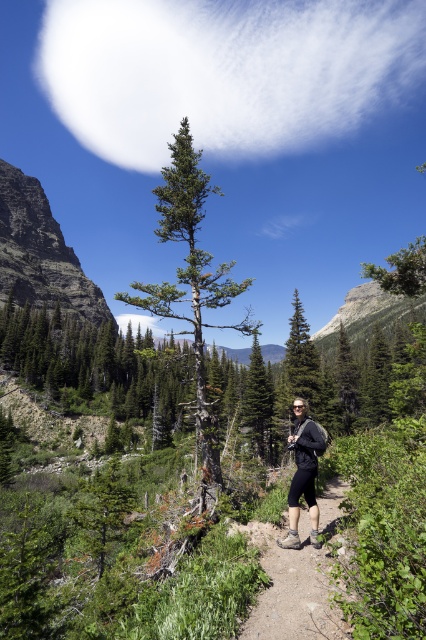
Can you confirm if rugged rock cliff at left is positioned to the right of brown dirt trail at center?

No, rugged rock cliff at left is not to the right of brown dirt trail at center.

The width and height of the screenshot is (426, 640). What are the coordinates of `rugged rock cliff at left` in the screenshot? It's located at (40, 252).

Where is `rugged rock cliff at left`? The height and width of the screenshot is (640, 426). rugged rock cliff at left is located at coordinates (40, 252).

Is green matte tree at center to the right of green rough bark tree at upper right from the viewer's perspective?

Incorrect, green matte tree at center is not on the right side of green rough bark tree at upper right.

Between point (256, 403) and point (374, 269), which one is positioned in front?

Point (374, 269)

Measure the distance between point (270,390) and camera.

A distance of 55.72 meters exists between point (270,390) and camera.

The image size is (426, 640). What are the coordinates of `green matte tree at center` in the screenshot? It's located at (258, 401).

Which is below, green rough bark tree at center or matte black hiking boots at center?

A: matte black hiking boots at center is below.

Is green rough bark tree at center in front of matte black hiking boots at center?

No, it is behind matte black hiking boots at center.

Find the location of a particular element. The width and height of the screenshot is (426, 640). green rough bark tree at center is located at coordinates [x=190, y=285].